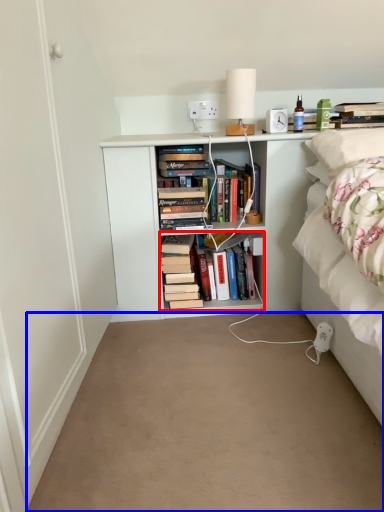
Question: Which object appears closest to the camera in this image, book (highlighted by a red box) or plain (highlighted by a blue box)?

Choices:
 (A) book
 (B) plain

Answer: (B)